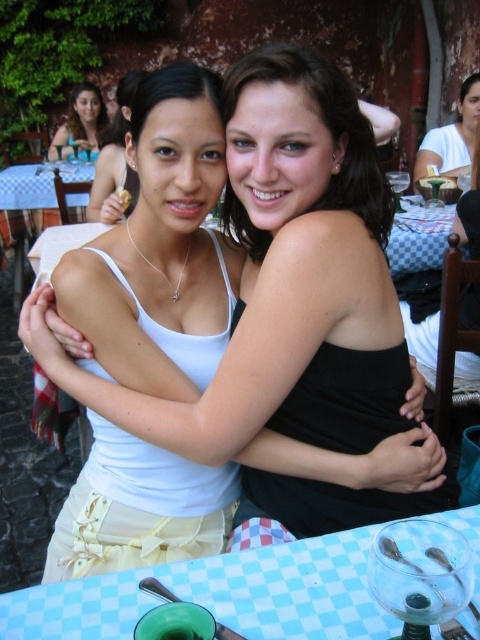
You are a photographer trying to capture the perfect shot of the two women at the outdoor dining area. You notice a specific point at coordinates point (291, 307). Based on the scene description, can you determine which object this point is located on?

The point (291, 307) is located on the white matte tank top at center.

Looking at this image, you are a photographer setting up for a portrait shoot at this outdoor dining area. You need to position a light source above the black matte dress at center so it casts a shadow towards the matte black hair at upper left. Is this possible based on their positions?

The black matte dress at center is positioned under the matte black hair at upper left, so placing a light source above the dress would cast a shadow towards the matte black hair at upper left. This setup is feasible based on their spatial arrangement.

You are a photographer setting up for a portrait. You need to ensure that the matte black hair at upper left and the matte white plate at center are both in frame. Given that your camera has a fixed focal length, which object should you prioritize framing first to accommodate their sizes?

The matte black hair at upper left is wider than the matte white plate at center, so you should prioritize framing the matte black hair at upper left first to ensure it fits within the camera frame before adjusting for the smaller matte white plate at center.